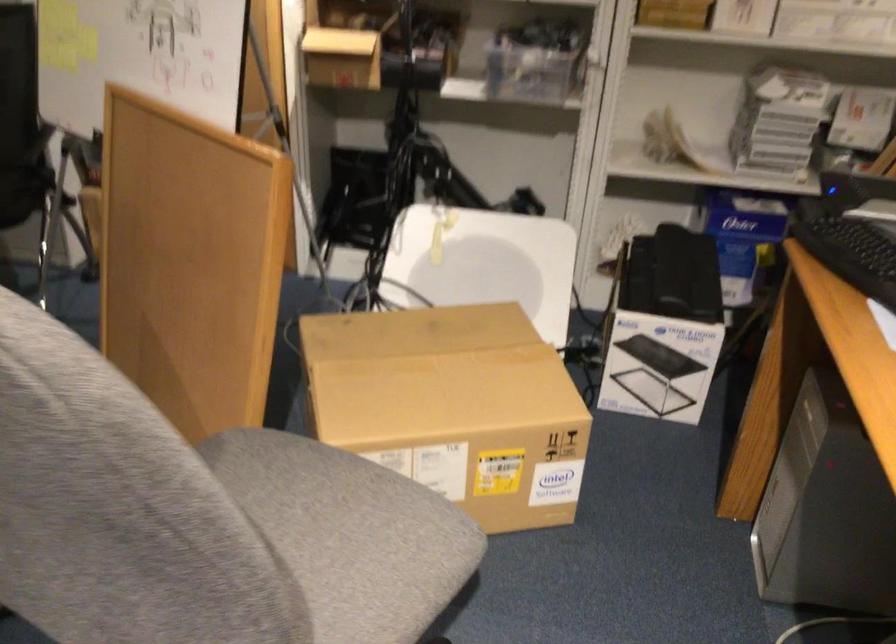
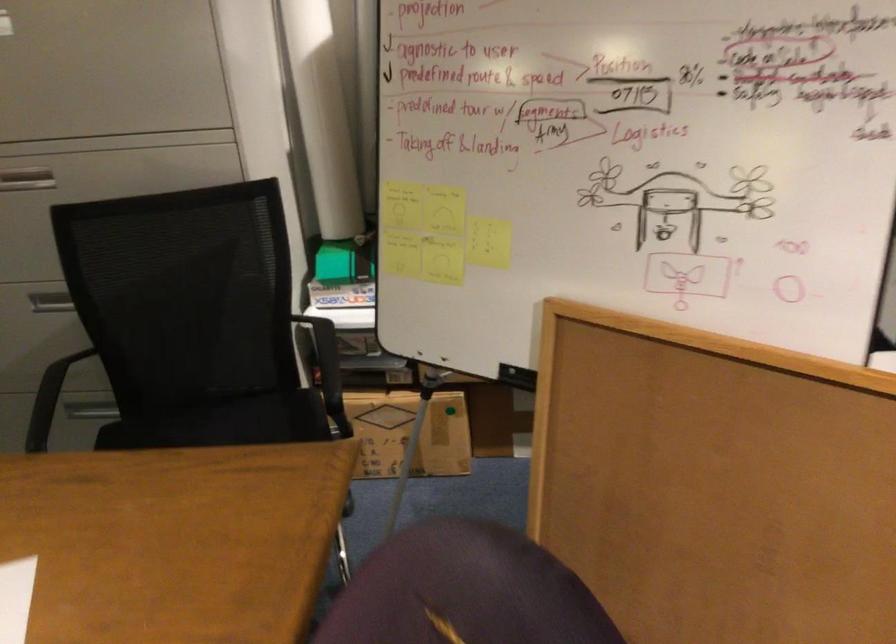
Consider the image. In a continuous first-person perspective shot, in which direction is the camera moving?

The cameraman walked toward left, forward.